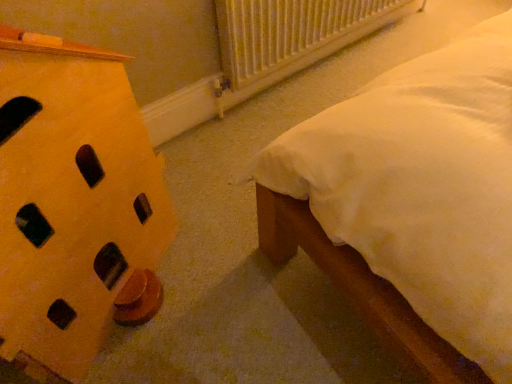
Question: Considering the positions of yellow matte wooden block at left and yellow matte nightstand at left in the image, is yellow matte wooden block at left bigger or smaller than yellow matte nightstand at left?

Choices:
 (A) small
 (B) big

Answer: (B)

Question: Would you say yellow matte wooden block at left is inside or outside yellow matte nightstand at left?

Choices:
 (A) outside
 (B) inside

Answer: (A)

Question: Estimate the real-world distances between objects in this image. Which object is farther from the yellow matte nightstand at left?

Choices:
 (A) yellow matte wooden block at left
 (B) white plastic radiator at upper center

Answer: (B)

Question: Which object is the closest to the yellow matte wooden block at left?

Choices:
 (A) white plastic radiator at upper center
 (B) yellow matte nightstand at left

Answer: (B)